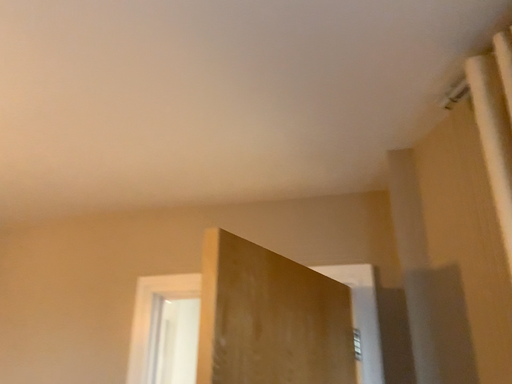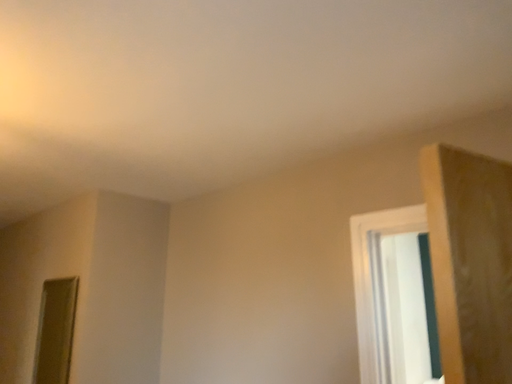
Question: How did the camera likely rotate when shooting the video?

Choices:
 (A) rotated left
 (B) rotated right

Answer: (A)